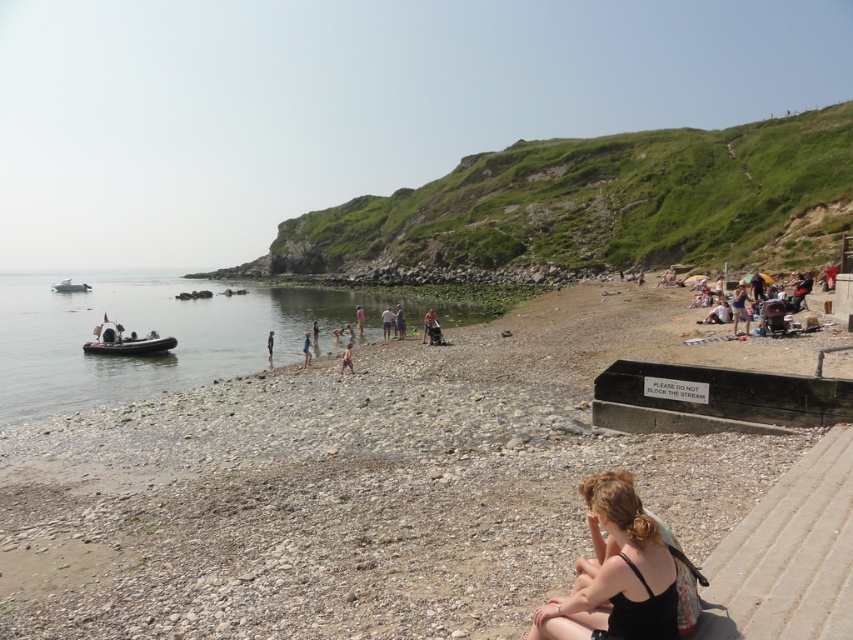
Question: Among these objects, which one is nearest to the camera?

Choices:
 (A) green grassy hillside at upper center
 (B) translucent rubber dinghy at lower left
 (C) smooth pebble beach at center
 (D) dark blue wetsuit at lower center

Answer: (C)

Question: Where is smooth pebble beach at center located in relation to dark blue wetsuit at lower center in the image?

Choices:
 (A) right
 (B) left

Answer: (A)

Question: Is matte black hair at lower right bigger than tan skin person at center?

Choices:
 (A) no
 (B) yes

Answer: (A)

Question: Which object is positioned closest to the green grassy hillside at upper center?

Choices:
 (A) light blue fabric at center
 (B) black concrete sign at lower right
 (C) translucent rubber dinghy at lower left

Answer: (C)

Question: Which object is positioned farthest from the translucent rubber dinghy at lower left?

Choices:
 (A) dark blue wetsuit at lower center
 (B) light blue fabric at center
 (C) smooth pebble beach at center
 (D) rubber dinghy at left

Answer: (A)

Question: Observing the image, what is the correct spatial positioning of matte black hair at lower right in reference to rubber dinghy at left?

Choices:
 (A) right
 (B) left

Answer: (A)